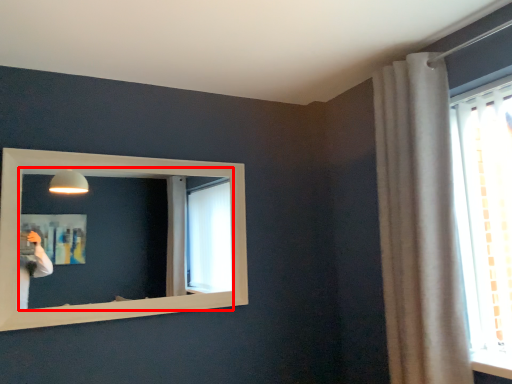
Question: From the image's perspective, where is mirror (annotated by the red box) located in relation to curtain in the image?

Choices:
 (A) below
 (B) above

Answer: (A)